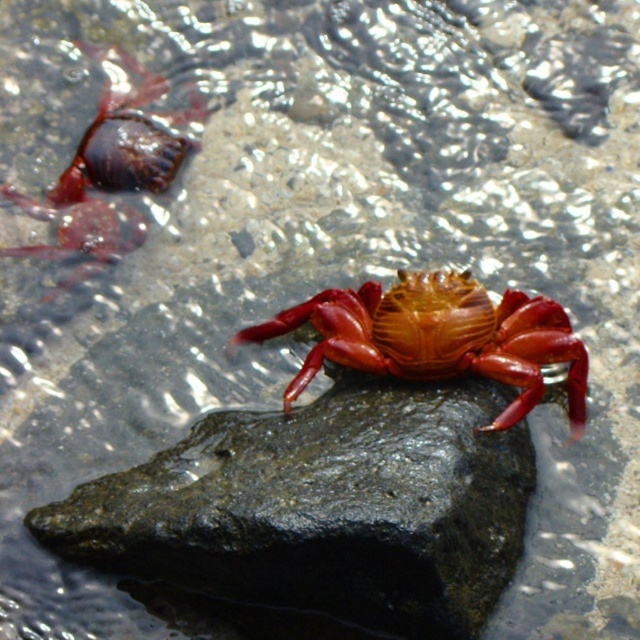
Question: Among these objects, which one is farthest from the camera?

Choices:
 (A) shiny red crab at center
 (B) black smooth rock at center
 (C) matte red crab at upper left

Answer: (C)

Question: Is black smooth rock at center positioned behind shiny red crab at center?

Choices:
 (A) no
 (B) yes

Answer: (A)

Question: Is the position of black smooth rock at center more distant than that of shiny red crab at center?

Choices:
 (A) no
 (B) yes

Answer: (A)

Question: Which object is closer to the camera taking this photo?

Choices:
 (A) matte red crab at upper left
 (B) black smooth rock at center

Answer: (B)

Question: Does black smooth rock at center appear under shiny red crab at center?

Choices:
 (A) yes
 (B) no

Answer: (A)

Question: Estimate the real-world distances between objects in this image. Which object is farther from the matte red crab at upper left?

Choices:
 (A) shiny red crab at center
 (B) black smooth rock at center

Answer: (B)